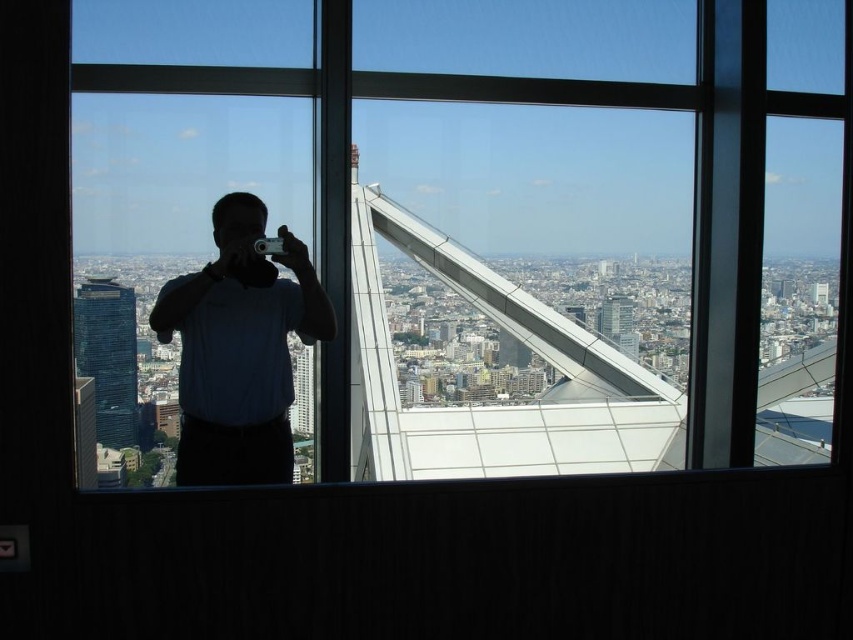
You are an interior designer assessing the space. You need to determine if a large poster that is the same size as the transparent glass window at center can be placed on the wall behind the matte blue shirt at center. Can the poster fit?

The transparent glass window at center is bigger than the matte blue shirt at center. Since the poster is the same size as the window, it may not fit behind the shirt if the wall space there is smaller. However, the description only states the window is larger than the shirt, not the wall dimensions. Without knowing the wall size, we cannot confirm. But since the shirt is smaller than the window, the poster might be too large for the area near the shirt unless the wall is sufficiently spacious.

You are a photographer standing in a high rise building. You want to take a photo of the cityscape through the transparent glass window at center while wearing the matte blue shirt at center. Considering the distance between the shirt and the window, will you be able to avoid your reflection appearing in the photo?

The distance between the transparent glass window at center and the matte blue shirt at center is 98.71 meters. Since the photographer is standing 98.71 meters away from the window, their reflection would not appear in the photo as they are too far from the glass surface to be reflected.

You are standing in a high rise building and want to take a photo of the cityscape. The point you are focusing on is located at coordinates point (140, 308). If your camera has a maximum focus range of 2000 feet, will you be able to focus on that point?

The point (140, 308) is 2160.81 feet away from the viewer, which exceeds the camera maximum focus range of 2000 feet. Therefore, you will not be able to focus on that point.